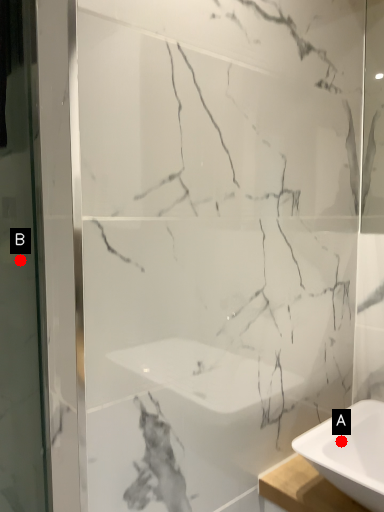
Question: Two points are circled on the image, labeled by A and B beside each circle. Which point is farther from the camera taking this photo?

Choices:
 (A) A is further
 (B) B is further

Answer: (B)